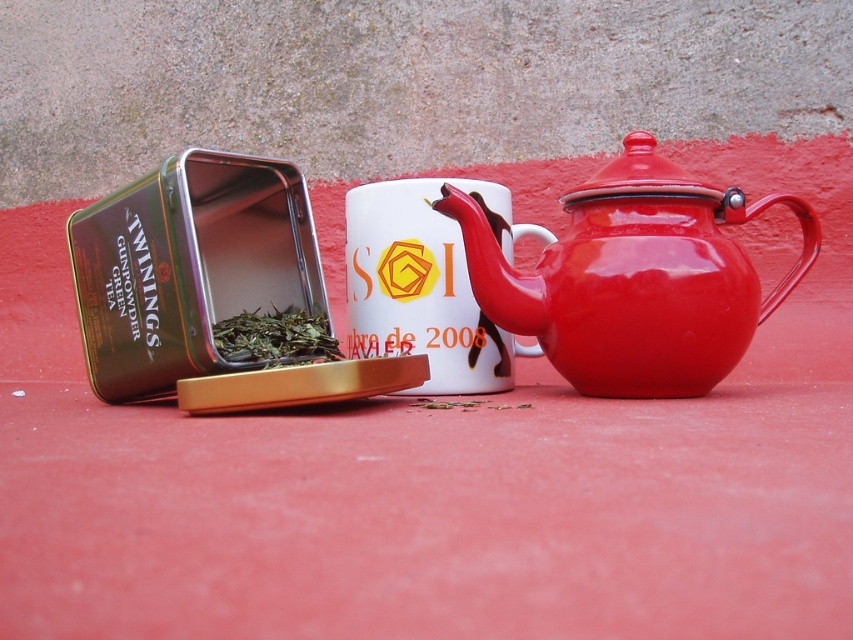
You are standing in front of the tea items arranged on the red surface. You notice two points marked on the image. Which point is closer to you, point (695, 276) or point (428, 225)?

Point (695, 276) is in front of point (428, 225), so it is closer to you.

You are holding a teabag and want to place it into the nearest container. Which object should you choose between the shiny enamel teapot at center right and the white glossy mug at center?

The shiny enamel teapot at center right is closer to the viewer than the white glossy mug at center, so you should choose the shiny enamel teapot at center right as it is nearer.

You are setting up a tea station and need to place both the shiny enamel teapot at center right and the glossy enamel teapot at center on a shelf that can only accommodate items up to 12 inches wide. Given their widths, can both teapots fit side by side on the shelf?

The shiny enamel teapot at center right is wider than the glossy enamel teapot at center. However, without knowing their exact widths, it is impossible to determine if their combined width exceeds 12 inches. Additional information about their individual measurements is required to answer this accurately.